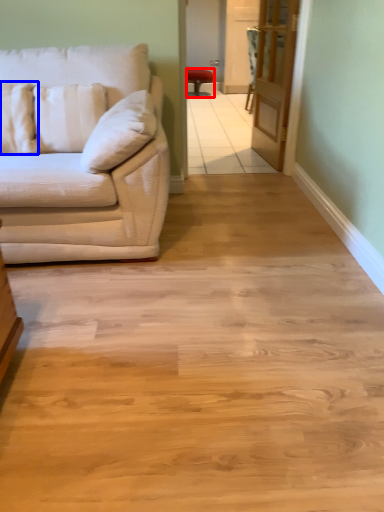
Question: Which object is further to the camera taking this photo, chair (highlighted by a red box) or pillow (highlighted by a blue box)?

Choices:
 (A) chair
 (B) pillow

Answer: (A)